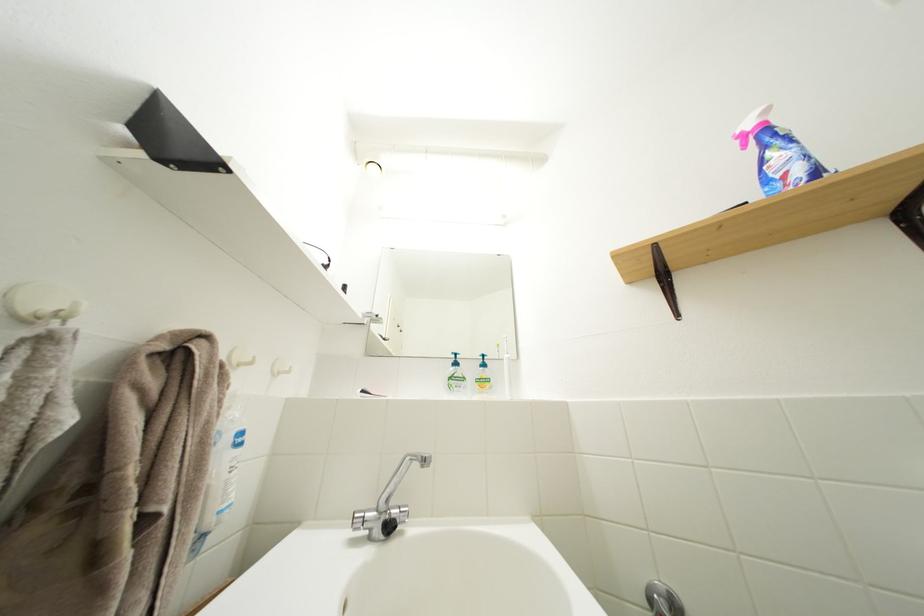
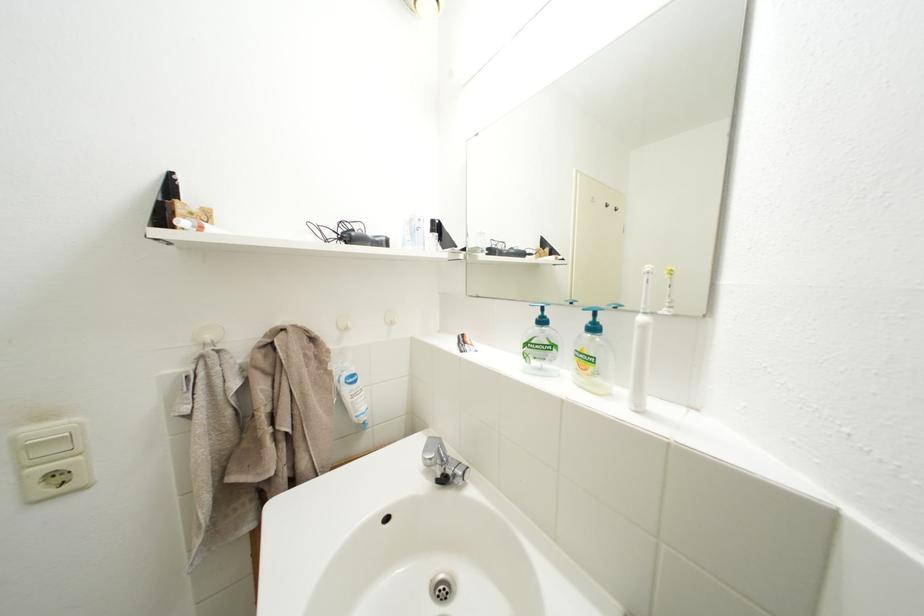
The first image is from the beginning of the video and the second image is from the end. How did the camera likely rotate when shooting the video?

The rotation direction of the camera is left-down.